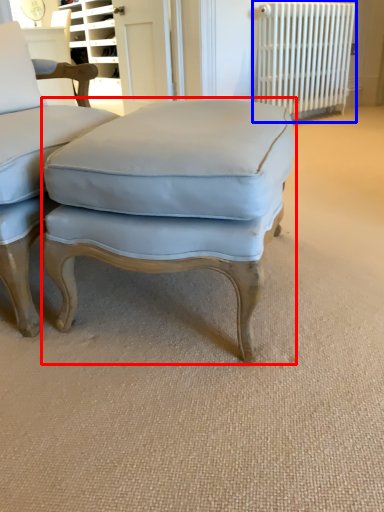
Question: Which point is closer to the camera, stool (highlighted by a red box) or radiator (highlighted by a blue box)?

Choices:
 (A) stool
 (B) radiator

Answer: (A)